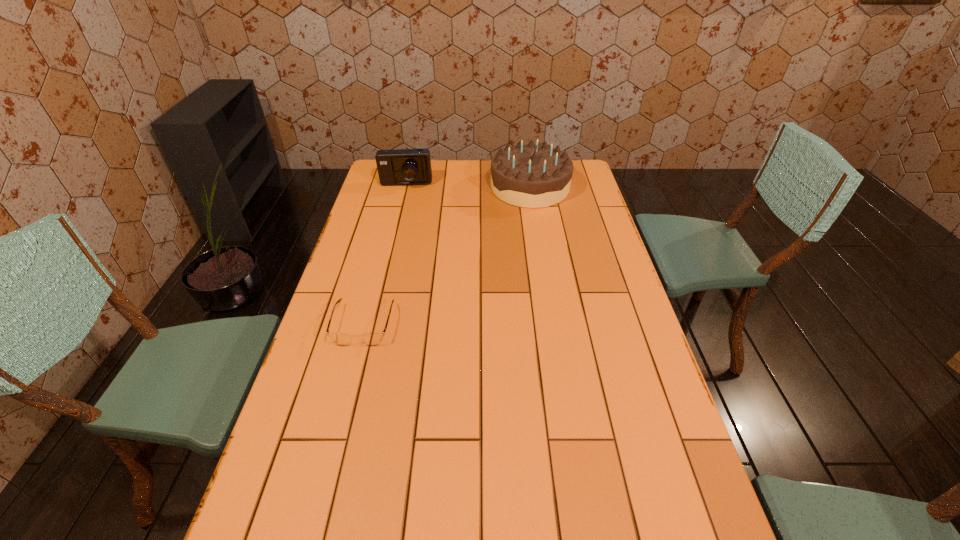
Identify the location of unoccupied position between the birthday cake and the camera. Image resolution: width=960 pixels, height=540 pixels. (468, 186).

Where is `vacant area that lies between the second shortest object and the shortest object`? The width and height of the screenshot is (960, 540). vacant area that lies between the second shortest object and the shortest object is located at coordinates click(385, 255).

Identify the location of unoccupied area between the nearest object and the second shortest object. Image resolution: width=960 pixels, height=540 pixels. (385, 255).

The height and width of the screenshot is (540, 960). Identify the location of free space between the spectacles and the second shortest object. (385, 255).

Image resolution: width=960 pixels, height=540 pixels. In order to click on vacant area that lies between the nearest object and the second tallest object in this screenshot , I will do `click(385, 255)`.

Where is `empty space between the camera and the birthday cake`? The image size is (960, 540). empty space between the camera and the birthday cake is located at coordinates (468, 186).

Locate an element on the screen. The height and width of the screenshot is (540, 960). vacant area that lies between the second tallest object and the rightmost object is located at coordinates (468, 186).

You are a GUI agent. You are given a task and a screenshot of the screen. Output one action in this format:
    pyautogui.click(x=<x>, y=<y>)
    Task: Click on the blank region between the birthday cake and the spectacles
    The width and height of the screenshot is (960, 540).
    Given the screenshot: What is the action you would take?
    pyautogui.click(x=446, y=256)

You are a GUI agent. You are given a task and a screenshot of the screen. Output one action in this format:
    pyautogui.click(x=<x>, y=<y>)
    Task: Click on the blank region between the birthday cake and the second shortest object
    This screenshot has height=540, width=960.
    Given the screenshot: What is the action you would take?
    pyautogui.click(x=468, y=186)

Locate which object ranks second in proximity to the rightmost object. Please provide its 2D coordinates. Your answer should be formatted as a tuple, i.e. [(x, y)], where the tuple contains the x and y coordinates of a point satisfying the conditions above.

[(372, 339)]